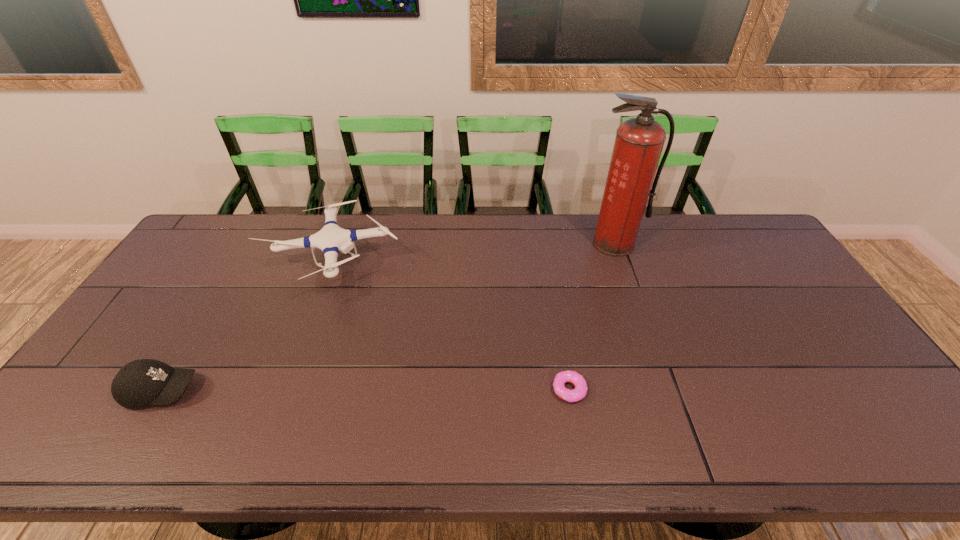
You are a GUI agent. You are given a task and a screenshot of the screen. Output one action in this format:
    pyautogui.click(x=<x>, y=<y>)
    Task: Click on the free space between the third shortest object and the rightmost object
    This screenshot has width=960, height=540.
    Given the screenshot: What is the action you would take?
    pyautogui.click(x=473, y=254)

At what (x,y) coordinates should I click in order to perform the action: click on free space between the tallest object and the baseball cap. Please return your answer as a coordinate pair (x, y). The height and width of the screenshot is (540, 960). Looking at the image, I should click on (388, 317).

This screenshot has width=960, height=540. I want to click on vacant region between the third object from left to right and the third tallest object, so click(366, 390).

In order to click on free space that is in between the shortest object and the baseball cap in this screenshot , I will do `click(366, 390)`.

Locate an element on the screen. Image resolution: width=960 pixels, height=540 pixels. free spot between the second shortest object and the second tallest object is located at coordinates (247, 327).

The width and height of the screenshot is (960, 540). I want to click on vacant space in between the baseball cap and the rightmost object, so click(x=388, y=317).

At what (x,y) coordinates should I click in order to perform the action: click on vacant area between the drone and the rightmost object. Please return your answer as a coordinate pair (x, y). The height and width of the screenshot is (540, 960). Looking at the image, I should click on (473, 254).

Locate an element on the screen. free spot between the rightmost object and the doughnut is located at coordinates (591, 317).

Locate an element on the screen. free space between the second shortest object and the second object from right to left is located at coordinates coord(366,390).

Choose which object is the second nearest neighbor to the third tallest object. Please provide its 2D coordinates. Your answer should be formatted as a tuple, i.e. [(x, y)], where the tuple contains the x and y coordinates of a point satisfying the conditions above.

[(577, 394)]